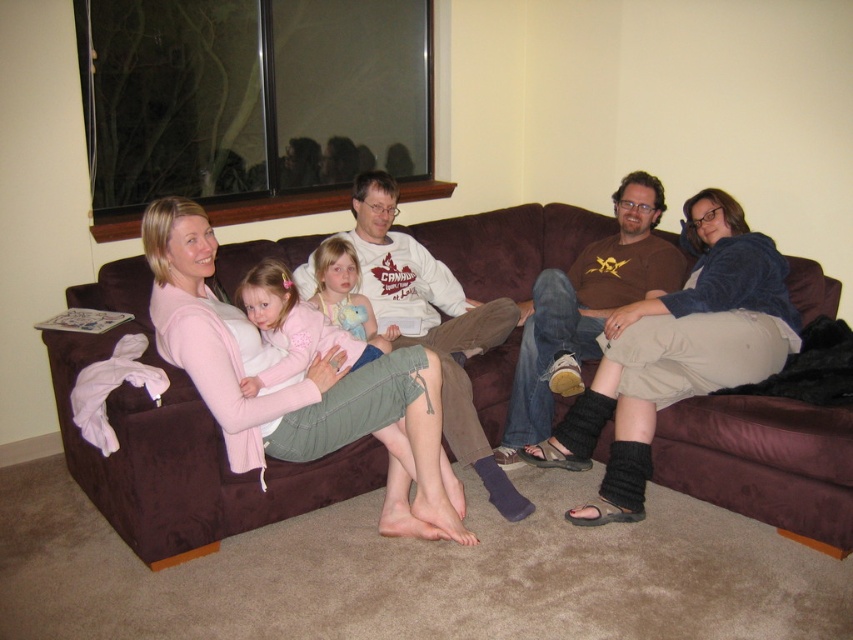
Question: Can you confirm if light pink sweater at center is positioned to the left of matte pink sweater at center?

Choices:
 (A) no
 (B) yes

Answer: (A)

Question: Which object is farther from the camera taking this photo?

Choices:
 (A) light pink sweater at center
 (B) knit beige socks at center

Answer: (A)

Question: Which object is positioned farthest from the matte pink sweater at center?

Choices:
 (A) brown suede couch at center
 (B) knit beige socks at center

Answer: (B)

Question: Does knit beige socks at center appear over light pink sweater at center?

Choices:
 (A) yes
 (B) no

Answer: (B)

Question: Which point is closer to the camera taking this photo?

Choices:
 (A) (781, 330)
 (B) (80, 337)
 (C) (393, 332)

Answer: (B)

Question: Is knit beige socks at center positioned behind matte pink sweater at center?

Choices:
 (A) yes
 (B) no

Answer: (B)